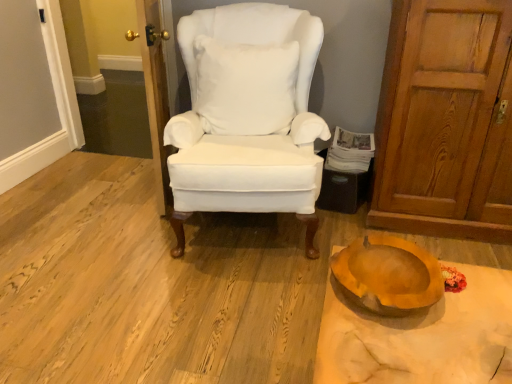
You are a GUI agent. You are given a task and a screenshot of the screen. Output one action in this format:
    pyautogui.click(x=<x>, y=<y>)
    Task: Click on the free space in front of matte orange bowl at lower right
    The height and width of the screenshot is (384, 512).
    Given the screenshot: What is the action you would take?
    pyautogui.click(x=413, y=346)